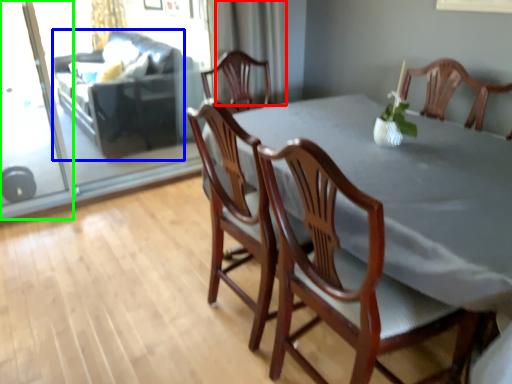
Question: Which is farther away from curtain (highlighted by a red box)? couch (highlighted by a blue box) or screen door (highlighted by a green box)?

Choices:
 (A) couch
 (B) screen door

Answer: (B)